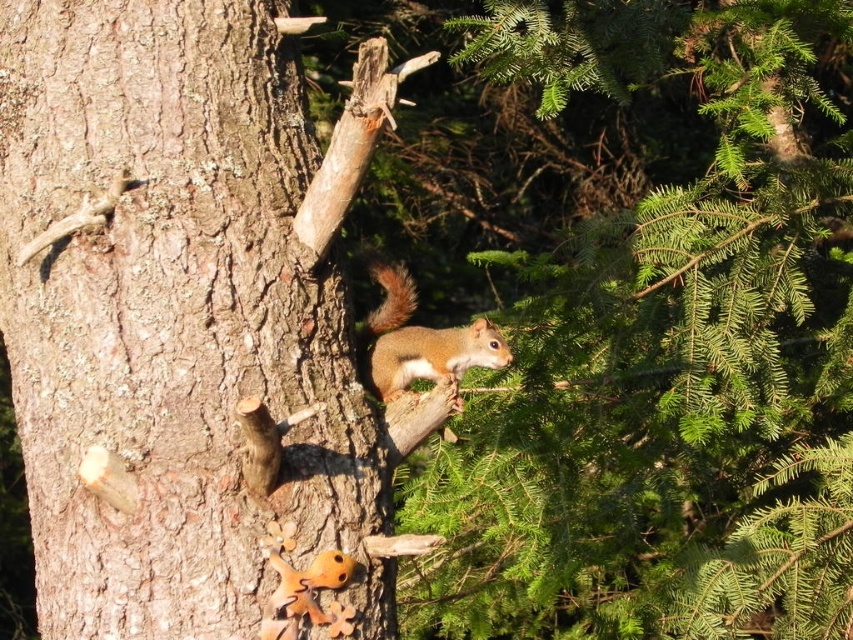
Question: Can you confirm if rough bark tree trunk at center is positioned to the right of shiny brown squirrel at center?

Choices:
 (A) no
 (B) yes

Answer: (A)

Question: Where is rough bark tree trunk at center located in relation to brown fuzzy tail at upper center in the image?

Choices:
 (A) right
 (B) left

Answer: (B)

Question: Which point is closer to the camera taking this photo?

Choices:
 (A) (219, 346)
 (B) (370, 273)

Answer: (A)

Question: Among these points, which one is nearest to the camera?

Choices:
 (A) (65, 305)
 (B) (410, 292)
 (C) (473, 352)

Answer: (A)

Question: Which is nearer to the shiny brown squirrel at center?

Choices:
 (A) rough bark tree trunk at center
 (B) brown fuzzy tail at upper center

Answer: (B)

Question: Is rough bark tree trunk at center closer to the viewer compared to brown fuzzy tail at upper center?

Choices:
 (A) yes
 (B) no

Answer: (A)